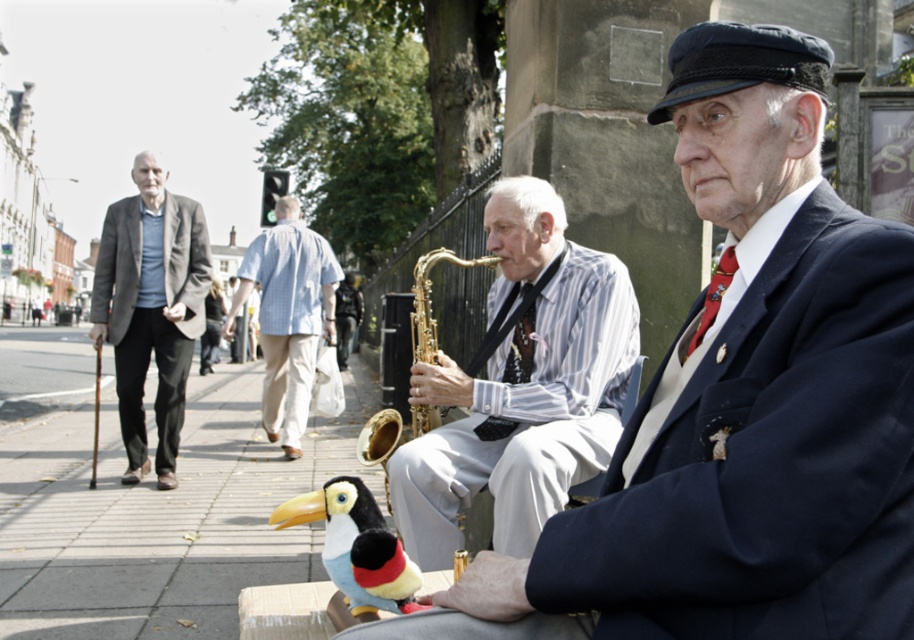
Is striped fabric shirt at center positioned before matte gray suit at left?

Yes, it is.

Is striped fabric shirt at center below matte gray suit at left?

Correct, striped fabric shirt at center is located below matte gray suit at left.

Between point (434, 465) and point (144, 326), which one is positioned in front?

Positioned in front is point (434, 465).

At what (x,y) coordinates should I click in order to perform the action: click on striped fabric shirt at center. Please return your answer as a coordinate pair (x, y). Looking at the image, I should click on (521, 385).

Where is `light blue checkered shirt at center`? light blue checkered shirt at center is located at coordinates (288, 316).

The width and height of the screenshot is (914, 640). Describe the element at coordinates (288, 316) in the screenshot. I see `light blue checkered shirt at center` at that location.

Who is more distant from viewer, (271, 228) or (271, 524)?

Point (271, 228)

Find the location of a particular element. light blue checkered shirt at center is located at coordinates (288, 316).

Based on the photo, which is above, matte black suit at center or soft beige pavement at lower left?

matte black suit at center is higher up.

Between point (891, 589) and point (101, 461), which one is positioned in front?

Point (891, 589)

Does point (827, 193) come farther from viewer compared to point (186, 604)?

That is False.

Identify the location of matte black suit at center. (741, 404).